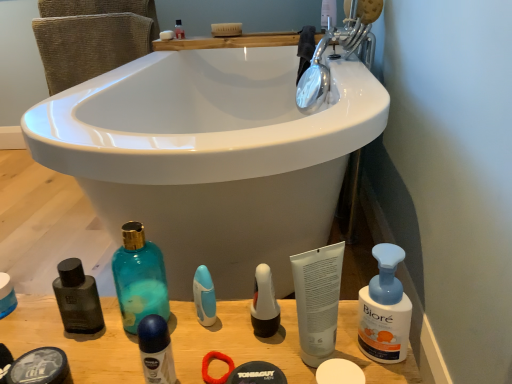
Identify the location of white glossy pump bottle at center, placed as the 5th toiletry when sorted from left to right. The height and width of the screenshot is (384, 512). (264, 304).

Measure the distance between point (276, 316) and camera.

They are 63.70 centimeters apart.

At what (x,y) coordinates should I click in order to perform the action: click on white matte tube at center, arranged as the second toiletry when viewed from the top. Please return your answer as a coordinate pair (x, y). The height and width of the screenshot is (384, 512). Looking at the image, I should click on (317, 300).

What do you see at coordinates (156, 350) in the screenshot? The height and width of the screenshot is (384, 512). I see `blue matte deodorant at center, acting as the fifth toiletry starting from the back` at bounding box center [156, 350].

How much space does blue plastic toothbrush at center, arranged as the 5th toiletry when viewed from the front, occupy horizontally?

blue plastic toothbrush at center, arranged as the 5th toiletry when viewed from the front, is 1.71 inches wide.

Identify the location of blue plastic toothbrush at center, positioned as the second toiletry in back-to-front order. (204, 296).

Locate an element on the screen. silver metallic faucet at upper right is located at coordinates (343, 49).

From the image's perspective, is white matte soap at upper center, arranged as the 2th soap when viewed from the right, located above or below blue plastic toothbrush at center, the third toiletry in the bottom-to-top sequence?

From the image's perspective, white matte soap at upper center, arranged as the 2th soap when viewed from the right, appears above blue plastic toothbrush at center, the third toiletry in the bottom-to-top sequence.

Is point (173, 38) positioned before point (214, 305)?

That is False.

Does white matte soap at upper center, marked as the 2th soap in a bottom-to-top arrangement, lie in front of blue plastic toothbrush at center, the third toiletry in the bottom-to-top sequence?

That is False.

Are white matte soap at upper center, arranged as the 2th soap when viewed from the right, and blue plastic toothbrush at center, which appears as the 3th toiletry when viewed from the right, far apart?

Yes, white matte soap at upper center, arranged as the 2th soap when viewed from the right, is far from blue plastic toothbrush at center, which appears as the 3th toiletry when viewed from the right.

Considering the relative positions of matte black bottle at lower left and white matte soap at lower center, which appears as the second soap when viewed from the back, in the image provided, is matte black bottle at lower left to the right of white matte soap at lower center, which appears as the second soap when viewed from the back, from the viewer's perspective?

No, matte black bottle at lower left is not to the right of white matte soap at lower center, which appears as the second soap when viewed from the back.

From the image's perspective, which one is positioned higher, matte black bottle at lower left or white matte soap at lower center, positioned as the 1th soap in right-to-left order?

matte black bottle at lower left.

Which of these two, matte black bottle at lower left or white matte soap at lower center, which is counted as the 2th soap, starting from the left, stands taller?

Standing taller between the two is matte black bottle at lower left.

Which soap is the 2nd one when counting from the right side of the matte black bottle at lower left? Please provide its 2D coordinates.

[(339, 372)]

Looking at this image, how much distance is there between blue matte deodorant at center, positioned as the 3th toiletry in left-to-right order, and teal glass bottle at lower left, positioned as the second cleaning product in right-to-left order?

A distance of 4.29 inches exists between blue matte deodorant at center, positioned as the 3th toiletry in left-to-right order, and teal glass bottle at lower left, positioned as the second cleaning product in right-to-left order.

How different are the orientations of blue matte deodorant at center, arranged as the fourth toiletry when viewed from the right, and teal glass bottle at lower left, the first cleaning product viewed from the left, in degrees?

The angle between the facing direction of blue matte deodorant at center, arranged as the fourth toiletry when viewed from the right, and the facing direction of teal glass bottle at lower left, the first cleaning product viewed from the left, is 0.0715 degrees.

The image size is (512, 384). Identify the location of the 2nd cleaning product above the blue matte deodorant at center, arranged as the fourth toiletry when viewed from the right (from the image's perspective). (139, 278).

Which object is closer to the camera taking this photo, blue matte deodorant at center, arranged as the fourth toiletry when viewed from the right, or teal glass bottle at lower left, positioned as the second cleaning product in right-to-left order?

Positioned in front is blue matte deodorant at center, arranged as the fourth toiletry when viewed from the right.

From the image's perspective, is white matte soap at upper center, arranged as the first soap when viewed from the top, on top of matte black shaving cream at lower left, positioned as the 6th toiletry in top-to-bottom order?

Yes, from the image's perspective, white matte soap at upper center, arranged as the first soap when viewed from the top, is on top of matte black shaving cream at lower left, positioned as the 6th toiletry in top-to-bottom order.

Between white matte soap at upper center, marked as the 2th soap in a bottom-to-top arrangement, and matte black shaving cream at lower left, which appears as the 5th toiletry when viewed from the right, which one is positioned in front?

matte black shaving cream at lower left, which appears as the 5th toiletry when viewed from the right, is closer to the camera.

You are a GUI agent. You are given a task and a screenshot of the screen. Output one action in this format:
    pyautogui.click(x=<x>, y=<y>)
    Task: Click on the soap on the left side of matte black shaving cream at lower left, the second toiletry when ordered from left to right
    The width and height of the screenshot is (512, 384).
    Given the screenshot: What is the action you would take?
    pyautogui.click(x=166, y=35)

Is white matte soap at upper center, placed as the first soap when sorted from left to right, spatially inside matte black shaving cream at lower left, the second toiletry when ordered from left to right, or outside of it?

white matte soap at upper center, placed as the first soap when sorted from left to right, is located beyond the bounds of matte black shaving cream at lower left, the second toiletry when ordered from left to right.

Between translucent plastic soap at upper center, the 1th toiletry when ordered from back to front, and translucent plastic pump at right, the second cleaning product when ordered from left to right, which one appears on the left side from the viewer's perspective?

Positioned to the left is translucent plastic soap at upper center, the 1th toiletry when ordered from back to front.

Is translucent plastic soap at upper center, acting as the sixth toiletry starting from the right, facing towards translucent plastic pump at right, the first cleaning product from the right?

No, translucent plastic soap at upper center, acting as the sixth toiletry starting from the right, is not facing towards translucent plastic pump at right, the first cleaning product from the right.

Measure the distance between translucent plastic soap at upper center, the 1th toiletry when ordered from back to front, and translucent plastic pump at right, the first cleaning product from the right.

translucent plastic soap at upper center, the 1th toiletry when ordered from back to front, and translucent plastic pump at right, the first cleaning product from the right, are 5.12 feet apart from each other.

From the image's perspective, between translucent plastic soap at upper center, which appears as the 1th toiletry when viewed from the top, and translucent plastic pump at right, the second cleaning product when ordered from left to right, who is located below?

From the image's view, translucent plastic pump at right, the second cleaning product when ordered from left to right, is below.

Is white matte soap at upper center, which is counted as the first soap, starting from the back, oriented towards translucent plastic soap at upper center, acting as the sixth toiletry starting from the right?

No, white matte soap at upper center, which is counted as the first soap, starting from the back, is not oriented towards translucent plastic soap at upper center, acting as the sixth toiletry starting from the right.

Can you confirm if white matte soap at upper center, arranged as the 2th soap when viewed from the right, is shorter than translucent plastic soap at upper center, the 1th toiletry when ordered from back to front?

Yes, white matte soap at upper center, arranged as the 2th soap when viewed from the right, is shorter than translucent plastic soap at upper center, the 1th toiletry when ordered from back to front.

What are the coordinates of `soap on the left of translucent plastic soap at upper center, which is the first toiletry in left-to-right order` in the screenshot? It's located at (166, 35).

Is white matte tube at center, the 6th toiletry from the back, oriented towards white matte soap at upper center, marked as the 2th soap in a bottom-to-top arrangement?

No.

From the image's perspective, is white matte tube at center, the fifth toiletry positioned from the bottom, located beneath white matte soap at upper center, placed as the first soap when sorted from left to right?

Yes, from the image's perspective, white matte tube at center, the fifth toiletry positioned from the bottom, is below white matte soap at upper center, placed as the first soap when sorted from left to right.

Which object is thinner, white matte tube at center, the 6th toiletry from the back, or white matte soap at upper center, placed as the first soap when sorted from left to right?

Thinner between the two is white matte soap at upper center, placed as the first soap when sorted from left to right.

Which of these two, white matte tube at center, the 6th toiletry from the back, or white matte soap at upper center, placed as the first soap when sorted from left to right, is bigger?

With larger size is white matte tube at center, the 6th toiletry from the back.

Find the location of `soap to the left of blue plastic toothbrush at center, positioned as the second toiletry in back-to-front order`. soap to the left of blue plastic toothbrush at center, positioned as the second toiletry in back-to-front order is located at coordinates (166, 35).

Where is `personal care above the white matte soap at lower center, positioned as the 1th soap in bottom-to-top order (from a real-world perspective)`? personal care above the white matte soap at lower center, positioned as the 1th soap in bottom-to-top order (from a real-world perspective) is located at coordinates (6, 295).

From the image, which object appears to be nearer to teal glass bottle at lower left, the first cleaning product viewed from the left, blue matte deodorant at center, placed as the fifth toiletry when sorted from top to bottom, or white glossy pump bottle at center, the third toiletry viewed from the back?

Based on the image, blue matte deodorant at center, placed as the fifth toiletry when sorted from top to bottom, appears to be nearer to teal glass bottle at lower left, the first cleaning product viewed from the left.

Based on their spatial positions, is white matte soap at lower center, positioned as the 1th soap in right-to-left order, or white matte tube at center, acting as the first toiletry starting from the right, further from silver metallic faucet at upper right?

Among the two, white matte soap at lower center, positioned as the 1th soap in right-to-left order, is located further to silver metallic faucet at upper right.

Consider the image. Looking at the image, which one is located closer to blue matte deodorant at center, placed as the fifth toiletry when sorted from top to bottom, white glossy pump bottle at center, which is the third toiletry from top to bottom, or translucent plastic soap at upper center, acting as the sixth toiletry starting from the right?

Based on the image, white glossy pump bottle at center, which is the third toiletry from top to bottom, appears to be nearer to blue matte deodorant at center, placed as the fifth toiletry when sorted from top to bottom.

When comparing their distances from white matte soap at lower center, positioned as the 1th soap in bottom-to-top order, does white matte soap at upper center, which is the second soap from front to back, or wooden counter top at lower center seem closer?

wooden counter top at lower center lies closer to white matte soap at lower center, positioned as the 1th soap in bottom-to-top order, than the other object.

From the image, which object appears to be nearer to wooden counter top at lower center, matte black shaving cream at lower left, which appears as the 5th toiletry when viewed from the right, or translucent plastic soap at upper center, acting as the sixth toiletry starting from the right?

matte black shaving cream at lower left, which appears as the 5th toiletry when viewed from the right, is closer to wooden counter top at lower center.

From the image, which object appears to be nearer to white glossy pump bottle at center, the 4th toiletry from the bottom, translucent plastic soap at upper center, the 6th toiletry in the bottom-to-top sequence, or teal glass bottle at lower left, positioned as the second cleaning product in right-to-left order?

teal glass bottle at lower left, positioned as the second cleaning product in right-to-left order, lies closer to white glossy pump bottle at center, the 4th toiletry from the bottom, than the other object.

Consider the image. Estimate the real-world distances between objects in this image. Which object is further from silver metallic faucet at upper right, white matte tube at center, which ranks as the 6th toiletry in left-to-right order, or translucent plastic soap at upper center, which appears as the 1th toiletry when viewed from the top?

white matte tube at center, which ranks as the 6th toiletry in left-to-right order, is further to silver metallic faucet at upper right.

Considering their positions, is blue matte deodorant at center, acting as the fifth toiletry starting from the back, positioned closer to white glossy pump bottle at center, which appears as the 4th toiletry when viewed from the front, than white matte soap at lower center, which is counted as the 2th soap, starting from the left?

white matte soap at lower center, which is counted as the 2th soap, starting from the left.

Identify the location of toiletry between white glossy pump bottle at center, which appears as the 4th toiletry when viewed from the front, and translucent plastic soap at upper center, the 6th toiletry in the bottom-to-top sequence, in the front-back direction. (204, 296).

This screenshot has height=384, width=512. What are the coordinates of `cleaning product between matte black shaving cream at lower left, the second toiletry when ordered from left to right, and white matte soap at upper center, placed as the first soap when sorted from left to right, from front to back` in the screenshot? It's located at (139, 278).

Where is `personal care between blue matte deodorant at center, acting as the 2th toiletry starting from the bottom, and white matte soap at upper center, arranged as the first soap when viewed from the top, from front to back`? This screenshot has height=384, width=512. personal care between blue matte deodorant at center, acting as the 2th toiletry starting from the bottom, and white matte soap at upper center, arranged as the first soap when viewed from the top, from front to back is located at coordinates (6, 295).

This screenshot has height=384, width=512. Identify the location of cleaning product situated between matte black bottle at lower left and translucent plastic pump at right, the first cleaning product from the right, from left to right. (139, 278).